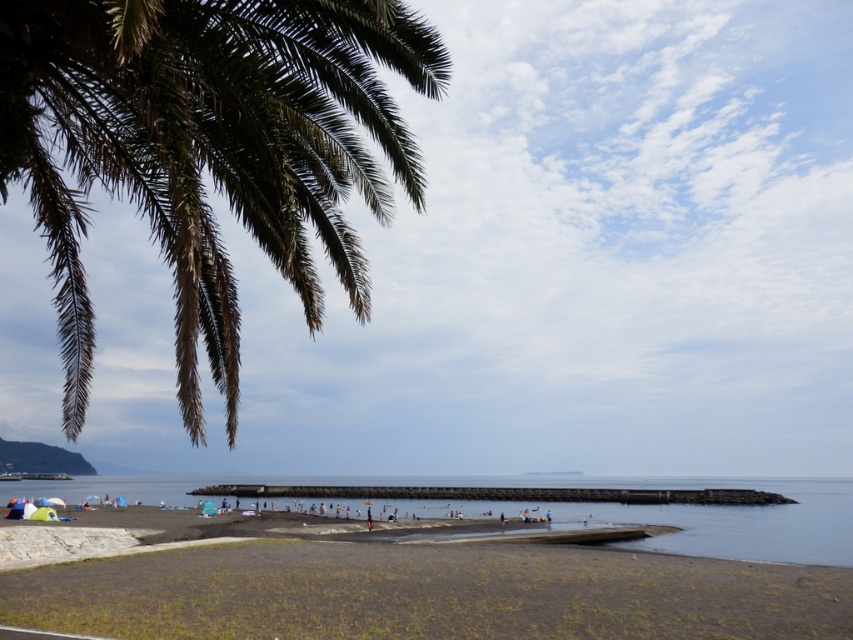
What do you see at coordinates (426, 593) in the screenshot? This screenshot has height=640, width=853. I see `brown sand at lower center` at bounding box center [426, 593].

Does brown sand at lower center have a lesser height compared to clear blue water at center?

Correct, brown sand at lower center is not as tall as clear blue water at center.

Is point (62, 621) closer to viewer compared to point (381, 500)?

Yes, point (62, 621) is in front of point (381, 500).

Image resolution: width=853 pixels, height=640 pixels. Identify the location of brown sand at lower center. (426, 593).

Who is lower down, brown/dry palm leaves at upper left or clear blue water at center?

clear blue water at center is lower down.

Which of these two, brown/dry palm leaves at upper left or clear blue water at center, stands taller?

clear blue water at center is taller.

The image size is (853, 640). Describe the element at coordinates (207, 148) in the screenshot. I see `brown/dry palm leaves at upper left` at that location.

Where is `brown/dry palm leaves at upper left`? brown/dry palm leaves at upper left is located at coordinates (207, 148).

Is point (312, 99) farther from camera compared to point (138, 609)?

No, it is not.

In the scene shown: Can you confirm if brown/dry palm leaves at upper left is shorter than brown sand at lower center?

No.

Does point (312, 116) lie in front of point (305, 540)?

Yes.

This screenshot has width=853, height=640. Find the location of `brown/dry palm leaves at upper left`. brown/dry palm leaves at upper left is located at coordinates (207, 148).